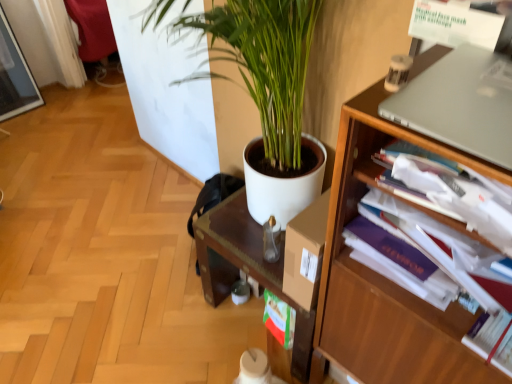
Locate an element on the screen. The height and width of the screenshot is (384, 512). free space above silver metallic laptop at upper right (from a real-world perspective) is located at coordinates (469, 94).